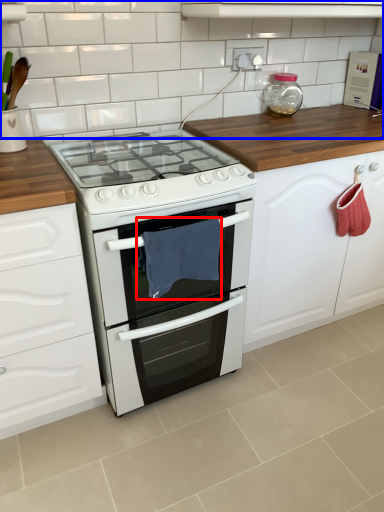
Question: Which object is further to the camera taking this photo, material (highlighted by a red box) or tile (highlighted by a blue box)?

Choices:
 (A) material
 (B) tile

Answer: (B)